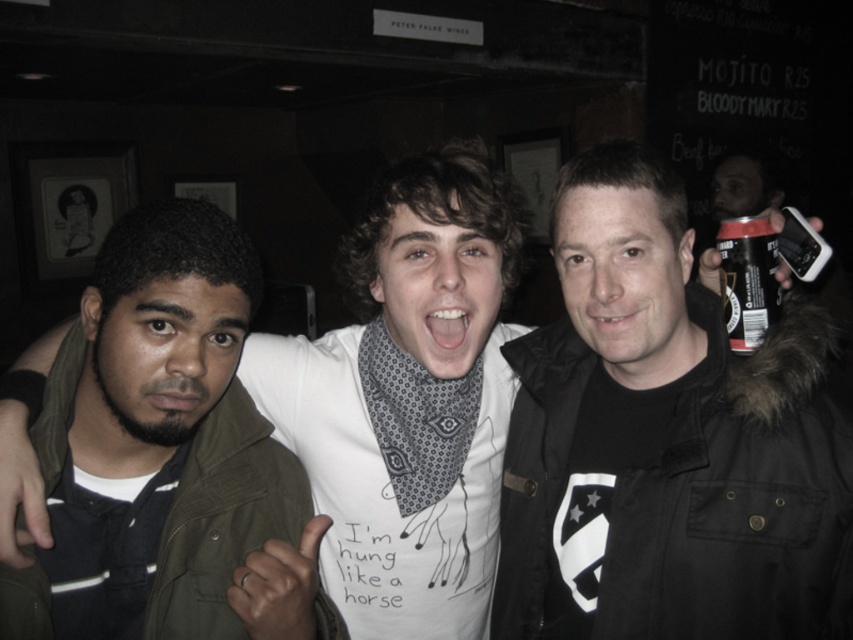
You are a bartender in the bar and need to place a new drink order. You see the green matte jacket at left and the black matte can at upper right. Which object is located to the left of the other?

The green matte jacket at left is positioned on the left side of black matte can at upper right.

You are standing in the bar and want to find the black matte jacket at center. Where should you look?

The black matte jacket at center is located at point 0.691 on the x axis and 0.781 on the y axis.

You are trying to decide which jacket to buy between the black matte jacket at center and the green matte jacket at left. Based on the image, which one is wider?

The black matte jacket at center is wider than the green matte jacket at left.